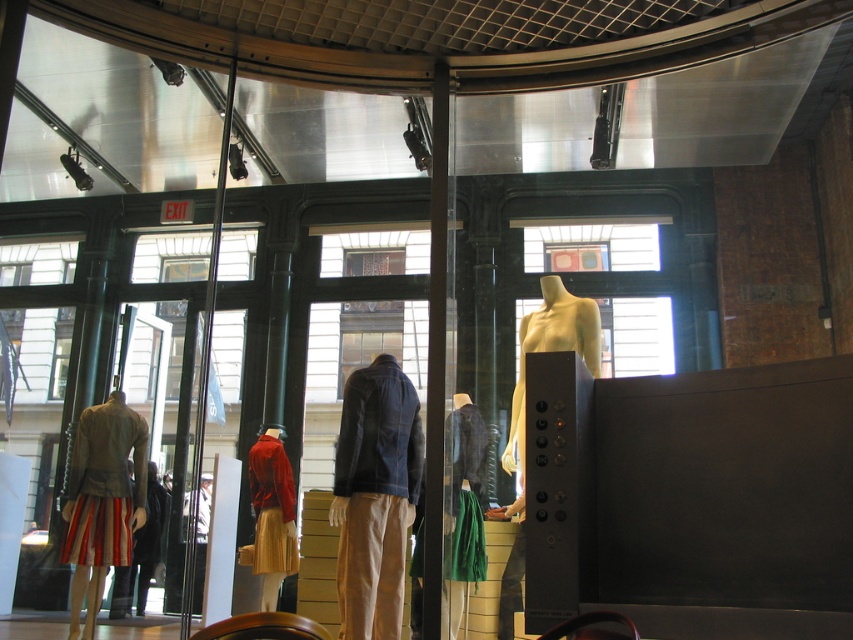
Question: Does shiny red jacket at center appear on the left side of leather jacket at lower left?

Choices:
 (A) yes
 (B) no

Answer: (B)

Question: Estimate the real-world distances between objects in this image. Which object is closer to the matte yellow mannequin at center?

Choices:
 (A) shiny red jacket at center
 (B) striped cotton skirt at lower left
 (C) denim jacket at center
 (D) leather jacket at lower left

Answer: (C)

Question: Is striped cotton skirt at lower left smaller than leather jacket at lower left?

Choices:
 (A) no
 (B) yes

Answer: (A)

Question: Does green fabric skirt at center appear on the left side of matte yellow mannequin at center?

Choices:
 (A) no
 (B) yes

Answer: (B)

Question: Which point is closer to the camera taking this photo?

Choices:
 (A) (520, 506)
 (B) (447, 612)
 (C) (392, 504)

Answer: (C)

Question: Which point is closer to the camera?

Choices:
 (A) striped cotton skirt at lower left
 (B) denim jacket at center

Answer: (B)